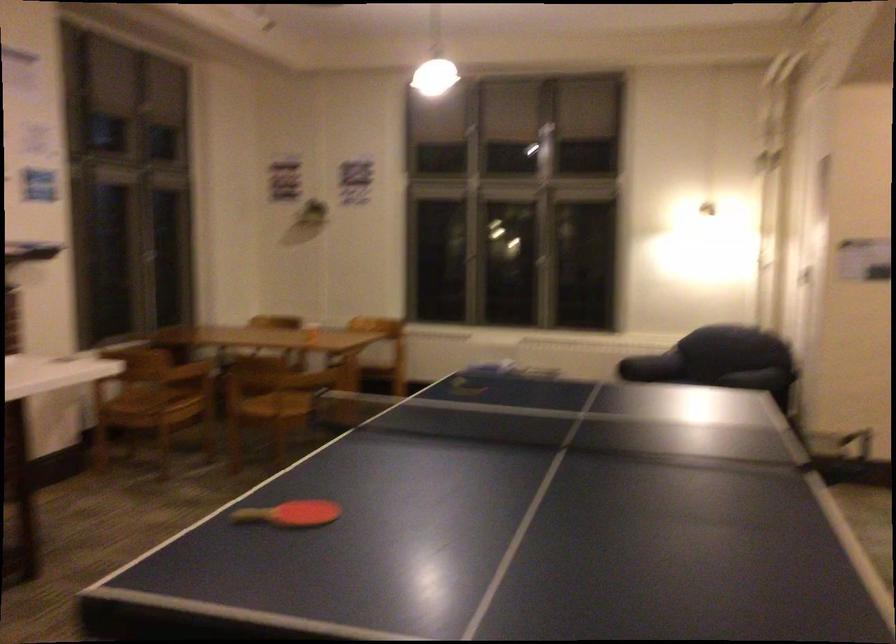
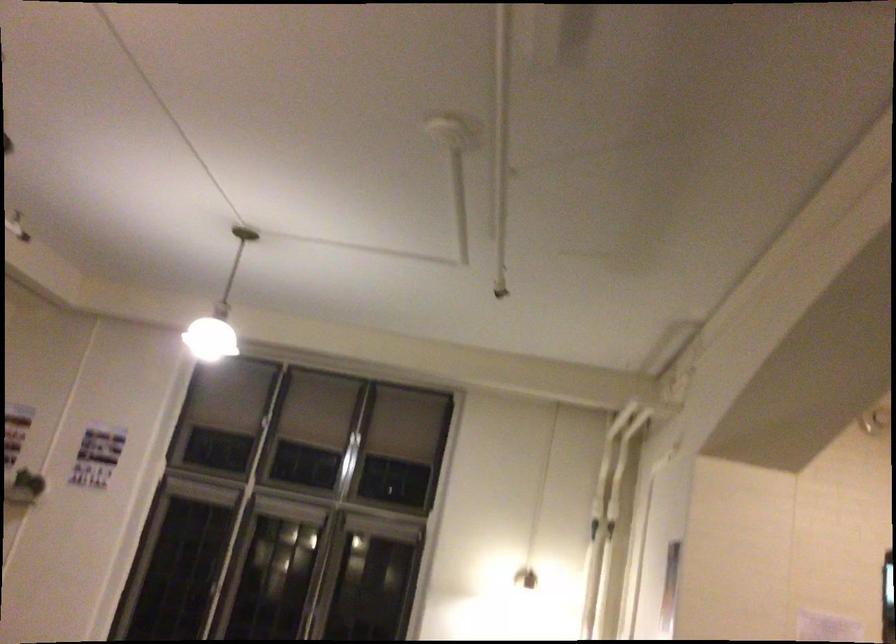
Find the pixel in the second image that matches the point at 515,98 in the first image.

(355, 437)